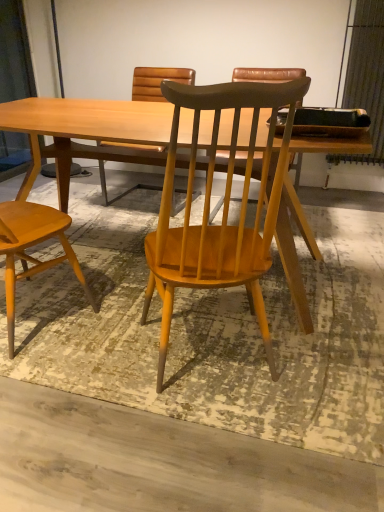
In order to face light wood table at center, should I rotate leftwards or rightwards?

You should look left and rotate roughly 4.954 degrees.

The height and width of the screenshot is (512, 384). Describe the element at coordinates (85, 132) in the screenshot. I see `light wood table at center` at that location.

In order to click on wooden chair at center, the first chair in the right-to-left sequence in this screenshot , I will do `click(223, 208)`.

This screenshot has height=512, width=384. In order to click on light wood table at center in this screenshot , I will do `click(85, 132)`.

From the image's perspective, is wooden chair at center, arranged as the second chair when viewed from the left, located beneath light wood table at center?

Yes, from the image's perspective, wooden chair at center, arranged as the second chair when viewed from the left, is below light wood table at center.

Is wooden chair at center, arranged as the second chair when viewed from the left, positioned with its back to light wood table at center?

That's not correct — wooden chair at center, arranged as the second chair when viewed from the left, is not looking away from light wood table at center.

Based on the photo, can you confirm if wooden chair at center, arranged as the second chair when viewed from the left, is wider than light wood table at center?

Incorrect, the width of wooden chair at center, arranged as the second chair when viewed from the left, does not surpass that of light wood table at center.

This screenshot has width=384, height=512. Identify the location of chair that is the 1st one above the light wood table at center (from a real-world perspective). (223, 208).

At what (x,y) coordinates should I click in order to perform the action: click on table lying above the wooden chair at center, the first chair in the right-to-left sequence (from the image's perspective). Please return your answer as a coordinate pair (x, y). Looking at the image, I should click on (85, 132).

Are light wood table at center and wooden chair at center, arranged as the second chair when viewed from the left, making contact?

There is a gap between light wood table at center and wooden chair at center, arranged as the second chair when viewed from the left.

Is light wood table at center inside the boundaries of wooden chair at center, the first chair in the right-to-left sequence, or outside?

light wood table at center is spatially situated outside wooden chair at center, the first chair in the right-to-left sequence.

Based on the photo, from a real-world perspective, is light wood table at center positioned above or below wooden chair at center, the first chair in the right-to-left sequence?

In terms of real-world spatial position, light wood table at center is below wooden chair at center, the first chair in the right-to-left sequence.

Where is `chair on the left of light wood table at center`? This screenshot has height=512, width=384. chair on the left of light wood table at center is located at coordinates (31, 246).

From the image's perspective, which one is positioned lower, light wood table at center or light brown wood chair at left, positioned as the 2th chair in right-to-left order?

light brown wood chair at left, positioned as the 2th chair in right-to-left order, is shown below in the image.

Would you say light wood table at center is to the left or to the right of light brown wood chair at left, the 1th chair when ordered from left to right, in the picture?

From the image, it's evident that light wood table at center is to the right of light brown wood chair at left, the 1th chair when ordered from left to right.

Between point (311, 145) and point (9, 301), which one is positioned in front?

The point (311, 145) is closer.

Does light brown wood chair at left, the 1th chair when ordered from left to right, have a smaller size compared to light wood table at center?

Yes, light brown wood chair at left, the 1th chair when ordered from left to right, is smaller than light wood table at center.

Looking at this image, from a real-world perspective, between light brown wood chair at left, positioned as the 2th chair in right-to-left order, and light wood table at center, who is vertically lower?

light wood table at center.

How different are the orientations of light brown wood chair at left, positioned as the 2th chair in right-to-left order, and light wood table at center in degrees?

The angular difference between light brown wood chair at left, positioned as the 2th chair in right-to-left order, and light wood table at center is 169 degrees.

Is wooden chair at center, arranged as the second chair when viewed from the left, behind light brown wood chair at left, positioned as the 2th chair in right-to-left order?

No, the depth of wooden chair at center, arranged as the second chair when viewed from the left, is less than that of light brown wood chair at left, positioned as the 2th chair in right-to-left order.

Is wooden chair at center, arranged as the second chair when viewed from the left, aimed at light brown wood chair at left, positioned as the 2th chair in right-to-left order?

No.

The height and width of the screenshot is (512, 384). Identify the location of chair above the wooden chair at center, arranged as the second chair when viewed from the left (from the image's perspective). (31, 246).

Considering the positions of point (239, 273) and point (24, 205), is point (239, 273) closer or farther from the camera than point (24, 205)?

Point (239, 273) appears to be closer to the viewer than point (24, 205).

Is there a large distance between light brown wood chair at left, positioned as the 2th chair in right-to-left order, and wooden chair at center, arranged as the second chair when viewed from the left?

That's not correct — light brown wood chair at left, positioned as the 2th chair in right-to-left order, is a little close to wooden chair at center, arranged as the second chair when viewed from the left.

How far apart are light brown wood chair at left, the 1th chair when ordered from left to right, and wooden chair at center, the first chair in the right-to-left sequence?

light brown wood chair at left, the 1th chair when ordered from left to right, is 23.89 inches away from wooden chair at center, the first chair in the right-to-left sequence.

Which object is thinner, light brown wood chair at left, the 1th chair when ordered from left to right, or wooden chair at center, arranged as the second chair when viewed from the left?

wooden chair at center, arranged as the second chair when viewed from the left, is thinner.

From a real-world perspective, is light brown wood chair at left, the 1th chair when ordered from left to right, physically above wooden chair at center, arranged as the second chair when viewed from the left?

Yes, from a real-world perspective, light brown wood chair at left, the 1th chair when ordered from left to right, is on top of wooden chair at center, arranged as the second chair when viewed from the left.

Where is `table behind the wooden chair at center, arranged as the second chair when viewed from the left`? Image resolution: width=384 pixels, height=512 pixels. table behind the wooden chair at center, arranged as the second chair when viewed from the left is located at coordinates (85, 132).

Where is `table that is above the wooden chair at center, arranged as the second chair when viewed from the left (from the image's perspective)`? Image resolution: width=384 pixels, height=512 pixels. table that is above the wooden chair at center, arranged as the second chair when viewed from the left (from the image's perspective) is located at coordinates (85, 132).

Which object lies further to the anchor point wooden chair at center, arranged as the second chair when viewed from the left, light wood table at center or light brown wood chair at left, the 1th chair when ordered from left to right?

light brown wood chair at left, the 1th chair when ordered from left to right, is positioned further to the anchor wooden chair at center, arranged as the second chair when viewed from the left.

When comparing their distances from light brown wood chair at left, positioned as the 2th chair in right-to-left order, does light wood table at center or wooden chair at center, the first chair in the right-to-left sequence, seem closer?

Among the two, light wood table at center is located nearer to light brown wood chair at left, positioned as the 2th chair in right-to-left order.

When comparing their distances from light brown wood chair at left, positioned as the 2th chair in right-to-left order, does wooden chair at center, arranged as the second chair when viewed from the left, or light wood table at center seem closer?

Based on the image, light wood table at center appears to be nearer to light brown wood chair at left, positioned as the 2th chair in right-to-left order.

Estimate the real-world distances between objects in this image. Which object is further from light wood table at center, light brown wood chair at left, positioned as the 2th chair in right-to-left order, or wooden chair at center, arranged as the second chair when viewed from the left?

Based on the image, light brown wood chair at left, positioned as the 2th chair in right-to-left order, appears to be further to light wood table at center.

Looking at this image, which object lies further to the anchor point wooden chair at center, arranged as the second chair when viewed from the left, light brown wood chair at left, positioned as the 2th chair in right-to-left order, or light wood table at center?

light brown wood chair at left, positioned as the 2th chair in right-to-left order.

Estimate the real-world distances between objects in this image. Which object is further from light wood table at center, wooden chair at center, arranged as the second chair when viewed from the left, or light brown wood chair at left, the 1th chair when ordered from left to right?

light brown wood chair at left, the 1th chair when ordered from left to right, lies further to light wood table at center than the other object.

Where is `table between light brown wood chair at left, the 1th chair when ordered from left to right, and wooden chair at center, the first chair in the right-to-left sequence, from left to right`? table between light brown wood chair at left, the 1th chair when ordered from left to right, and wooden chair at center, the first chair in the right-to-left sequence, from left to right is located at coordinates (85, 132).